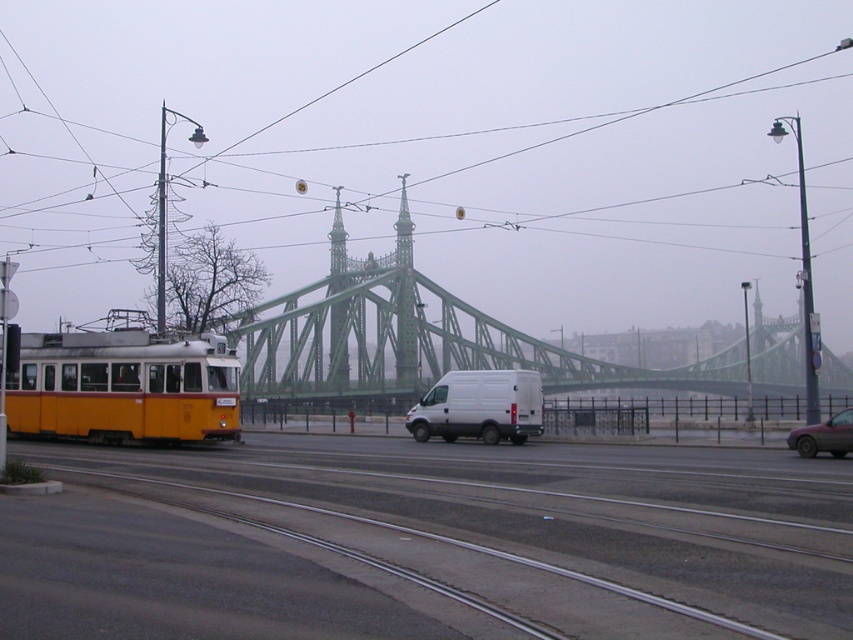
You are standing at the tram tracks and want to walk to the bridge. There are two points marked in the image. Which point, point (199, 589) or point (537, 392), is closer to you as you stand at the tram tracks?

Point (199, 589) is closer to the viewer than point (537, 392). Therefore, point (199, 589) is closer to you as you stand at the tram tracks.

You are a city planner reviewing this urban layout. The tram system requires maintenance access to the metallic gray tracks at center. If the maintenance vehicle is 2 meters wide, can it safely pass between the tram and the white van parked on the right side of the road near the tram tracks?

The position of metallic gray tracks at center is at point (427, 541), but without specific spatial measurements between the tram and the white van parked on the right side of the road near the tram tracks, it is impossible to determine if the maintenance vehicle can safely pass. Additional information about the distance between these objects is required.

You are a pedestrian standing at the tram stop on the left side of the road. You need to cross the road to reach the green bridge in the background. Which vehicle, the white matte van at center or the metallic red car at lower right, is closer to you as you prepare to cross?

The white matte van at center is closer to you because it is positioned to the left of the metallic red car at lower right, and since you are on the left side of the road, the van is nearer your current position.